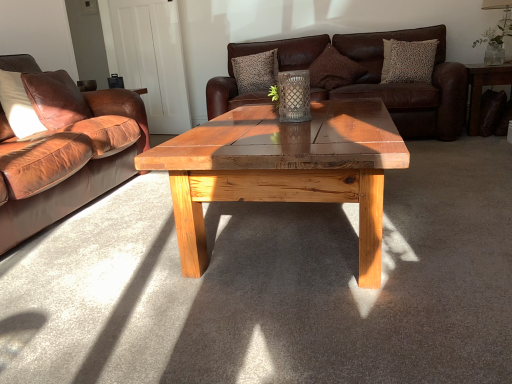
Question: Is point coord(35,87) positioned closer to the camera than point coord(5,139)?

Choices:
 (A) closer
 (B) farther

Answer: (B)

Question: Considering the positions of leather pillow at left, placed as the 1th pillow when sorted from left to right, and brown leather couch at left, the 2th studio couch viewed from the right, in the image, is leather pillow at left, placed as the 1th pillow when sorted from left to right, wider or thinner than brown leather couch at left, the 2th studio couch viewed from the right,?

Choices:
 (A) thin
 (B) wide

Answer: (A)

Question: Considering the real-world distances, which object is closest to the clear glass vase at upper right?

Choices:
 (A) brown leather couch at center, which is the first studio couch from back to front
 (B) leather pillow at left, the fourth pillow viewed from the back
 (C) textured brown pillow at upper center, acting as the third pillow starting from the right
 (D) brown leather couch at left, the 2th studio couch from the back
 (E) dark brown leather side table at right

Answer: (E)

Question: Based on their relative distances, which object is nearer to the patterned fabric pillow at upper right, the 1th pillow in the right-to-left sequence?

Choices:
 (A) textured brown pillow at upper center, the first pillow positioned from the back
 (B) dark brown leather side table at right
 (C) brown leather couch at left, the 2th studio couch from the back
 (D) matte white lampshade at upper right
 (E) clear glass vase at upper right

Answer: (B)